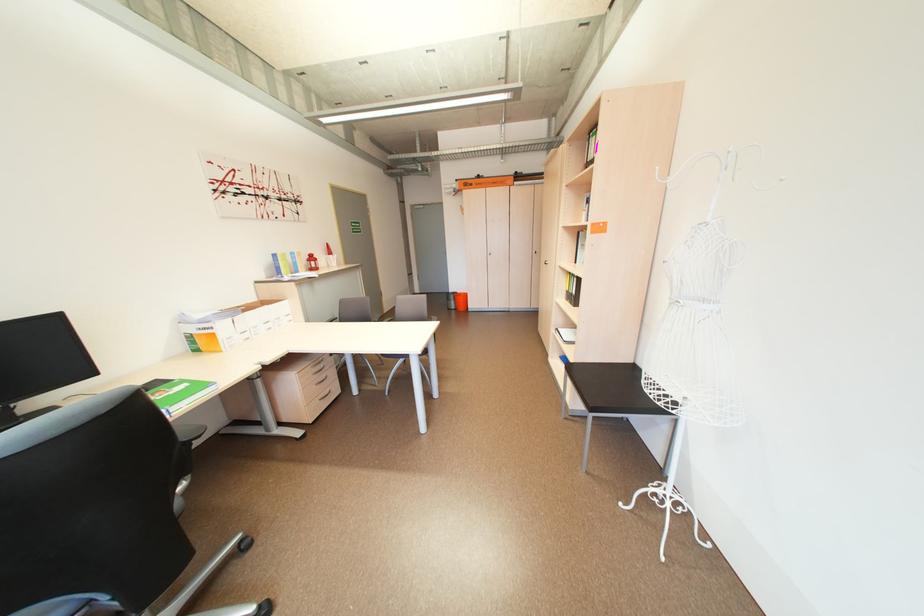
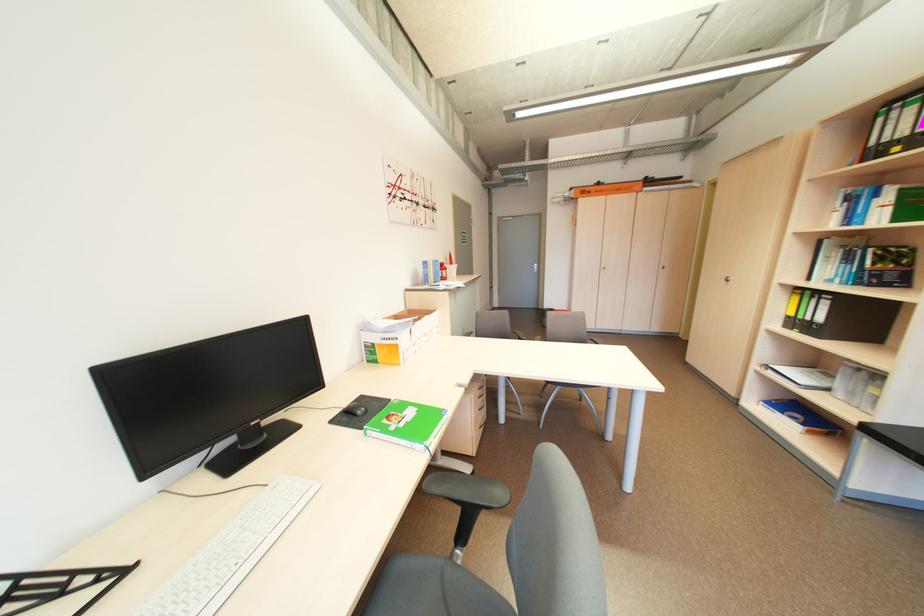
Where in the second image is the point corresponding to (x=480, y=185) from the first image?

(599, 193)